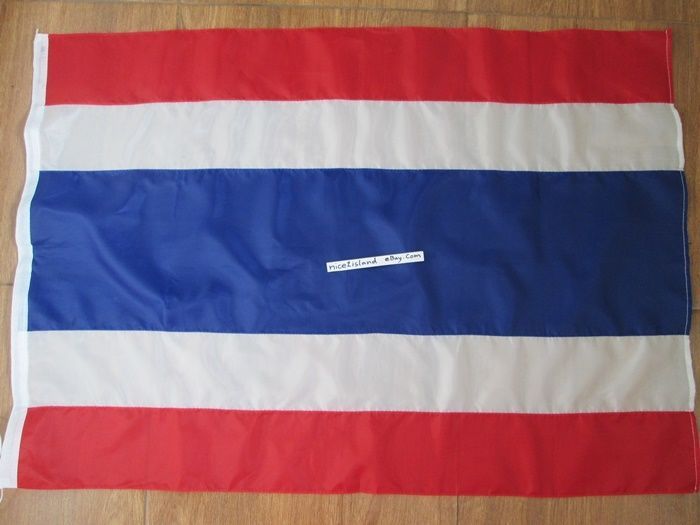
I want to click on brown wood background surface, so click(102, 506), click(211, 509), click(379, 517), click(517, 516), click(390, 12), click(118, 10), click(5, 104), click(685, 72).